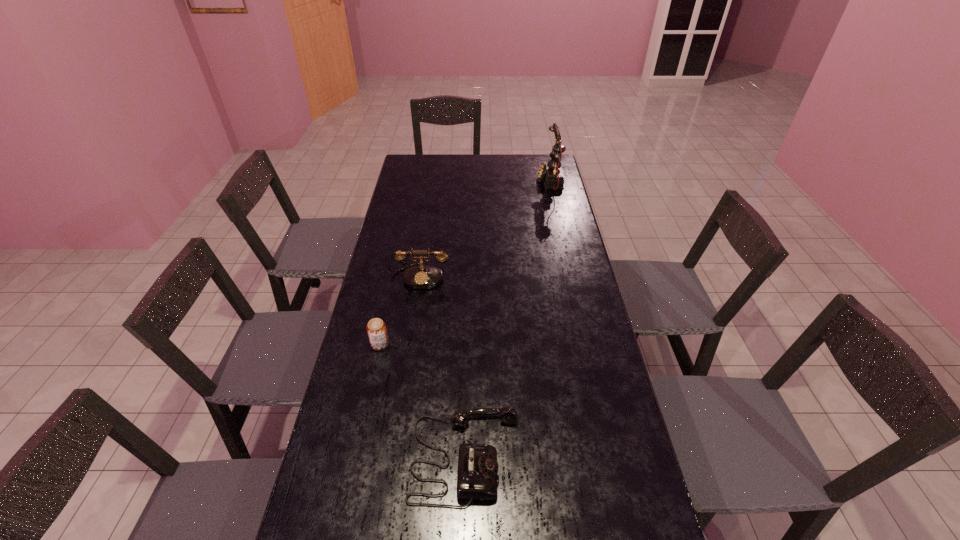
Where is `blank area located 0.120m on the dial of the second farthest object`? This screenshot has height=540, width=960. blank area located 0.120m on the dial of the second farthest object is located at coordinates (414, 316).

The image size is (960, 540). What are the coordinates of `free location located on the dial of the nearest object` in the screenshot? It's located at (561, 457).

Locate an element on the screen. vacant space located on the front of the third farthest object is located at coordinates (358, 444).

Find the location of a particular element. This screenshot has width=960, height=540. object situated at the far edge is located at coordinates (550, 171).

You are a GUI agent. You are given a task and a screenshot of the screen. Output one action in this format:
    pyautogui.click(x=<x>, y=<y>)
    Task: Click on the telephone that is at the left edge
    
    Given the screenshot: What is the action you would take?
    pyautogui.click(x=423, y=276)

Find the location of `beer can positioned at the left edge`. beer can positioned at the left edge is located at coordinates (376, 328).

In order to click on object located in the right edge section of the desktop in this screenshot , I will do `click(550, 171)`.

Where is `object that is at the far right corner`? This screenshot has height=540, width=960. object that is at the far right corner is located at coordinates (550, 171).

Identify the location of free region at the far edge of the desktop. The height and width of the screenshot is (540, 960). (468, 172).

In order to click on vacant area at the left edge of the desktop in this screenshot , I will do `click(388, 304)`.